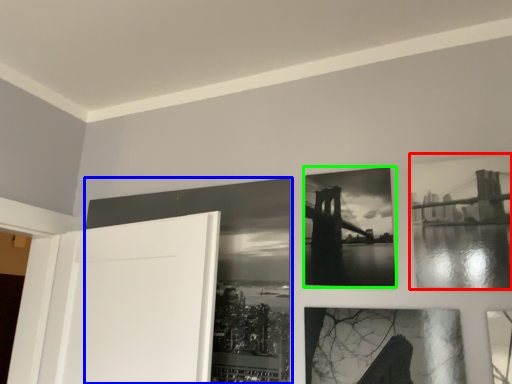
Question: Which is farther away from picture frame (highlighted by a red box)? picture frame (highlighted by a blue box) or picture frame (highlighted by a green box)?

Choices:
 (A) picture frame
 (B) picture frame

Answer: (A)